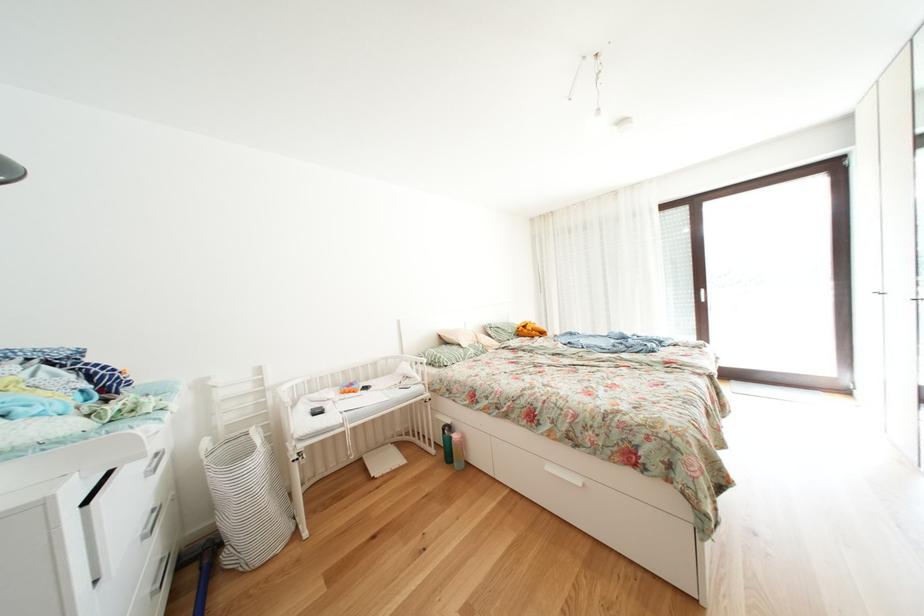
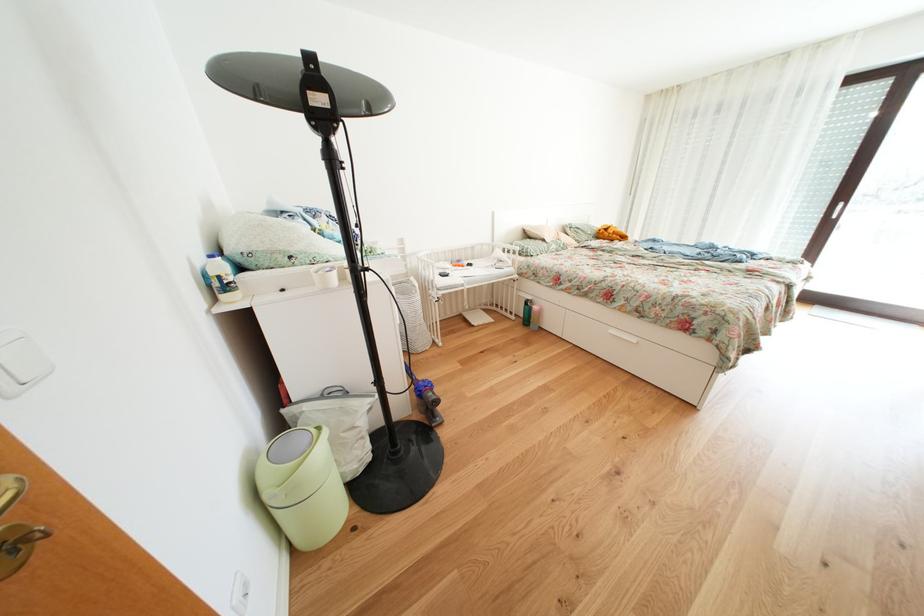
Where in the second image is the point corresponding to pixel 558 472 from the first image?

(622, 336)